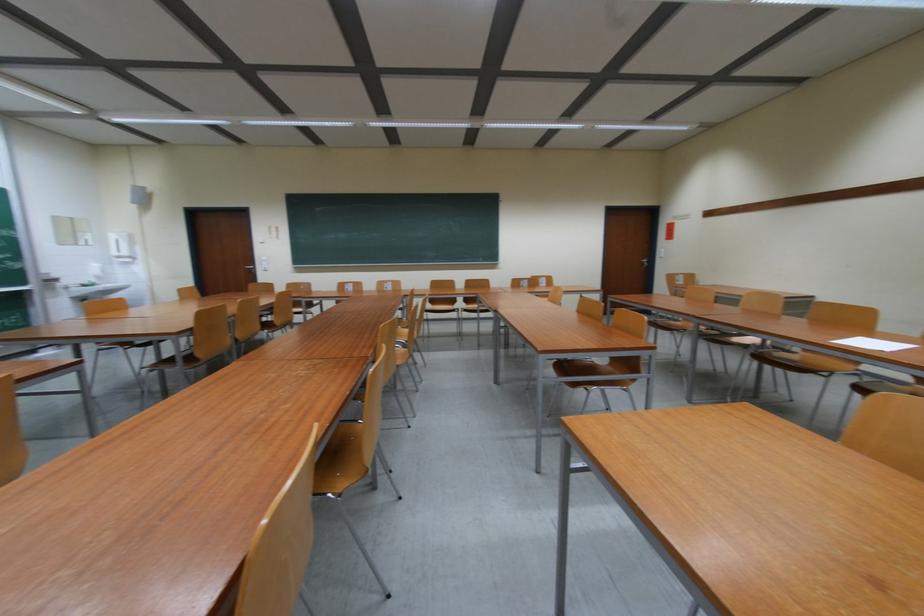
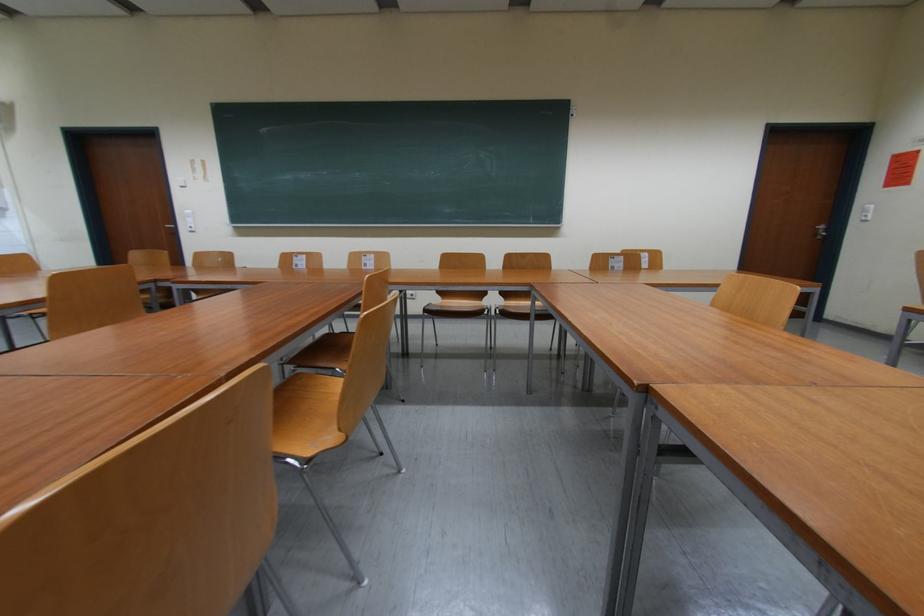
Question: Which direction would the cameraman need to move to produce the second image? Reply with the corresponding letter.

Choices:
 (A) Left
 (B) Right
 (C) Forward
 (D) Backward

Answer: (C)